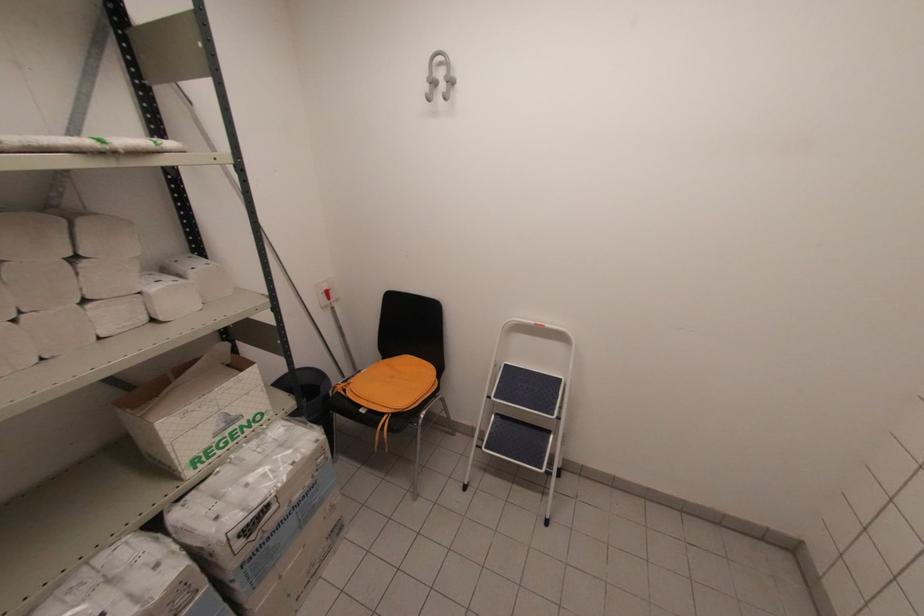
This screenshot has width=924, height=616. Find the location of `grey wall hook`. grey wall hook is located at coordinates (439, 76).